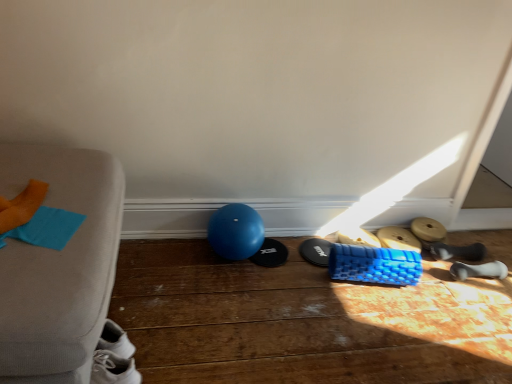
Image resolution: width=512 pixels, height=384 pixels. Find the location of `vacant space behind white rubber dumbbell at lower right, the 7th footwear viewed from the left`. vacant space behind white rubber dumbbell at lower right, the 7th footwear viewed from the left is located at coordinates (470, 251).